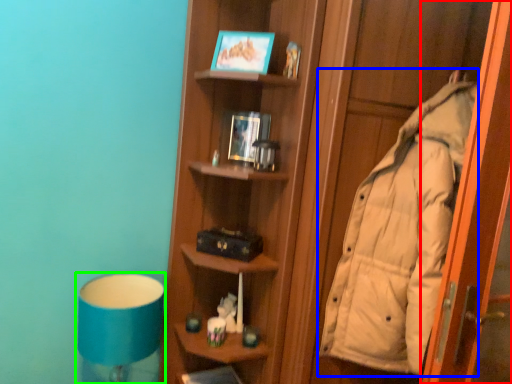
Question: Which object is the closest to the screen door (highlighted by a red box)? Choose among these: coat (highlighted by a blue box) or bedside lamp (highlighted by a green box).

Choices:
 (A) coat
 (B) bedside lamp

Answer: (A)